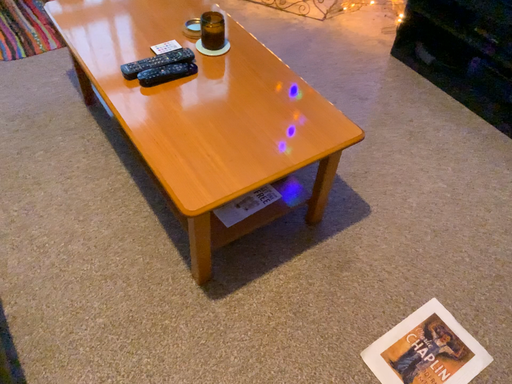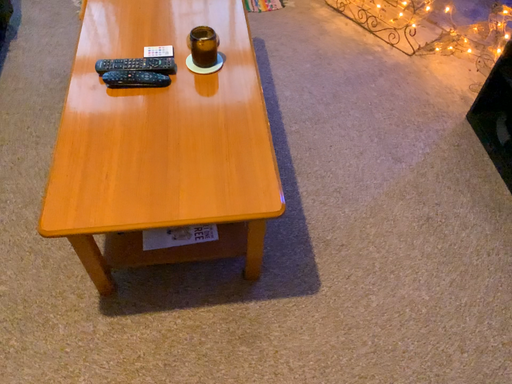
Question: How did the camera likely rotate when shooting the video?

Choices:
 (A) rotated left
 (B) rotated right

Answer: (A)